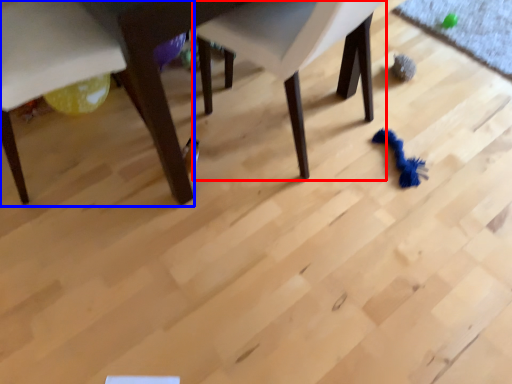
Question: Among these objects, which one is nearest to the camera, chair (highlighted by a red box) or chair (highlighted by a blue box)?

Choices:
 (A) chair
 (B) chair

Answer: (A)